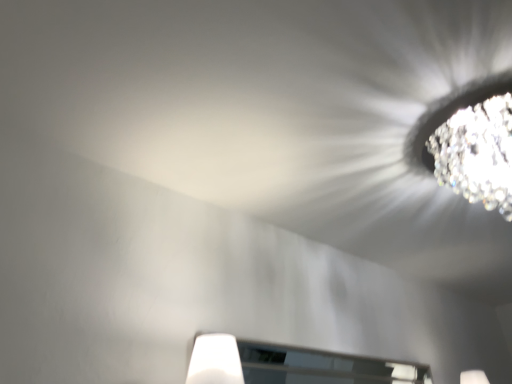
Question: Should I look upward or downward to see transparent glass window at lower center?

Choices:
 (A) down
 (B) up

Answer: (A)